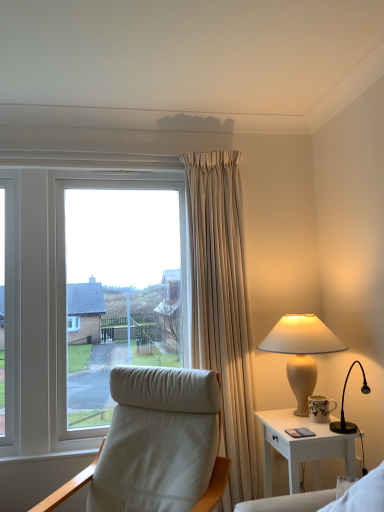
The width and height of the screenshot is (384, 512). Describe the element at coordinates (327, 498) in the screenshot. I see `white leather couch at lower right` at that location.

The height and width of the screenshot is (512, 384). Identify the location of white leather couch at lower right. (327, 498).

Where is `matte beige lamp at right`? Image resolution: width=384 pixels, height=512 pixels. matte beige lamp at right is located at coordinates (301, 351).

Is white glossy nightstand at right surrounding white leather chair at left?

No, white leather chair at left is located outside of white glossy nightstand at right.

From a real-world perspective, is white glossy nightstand at right positioned over white leather chair at left based on gravity?

No, from a real-world perspective, white glossy nightstand at right is not over white leather chair at left

Consider the image. Is white glossy nightstand at right next to white leather chair at left?

No, white glossy nightstand at right is not with white leather chair at left.

From the image's perspective, would you say white glossy nightstand at right is positioned over white leather chair at left?

No, from the image's perspective, white glossy nightstand at right is not above white leather chair at left.

Would you say white leather chair at left contains white glossy nightstand at right?

No, white glossy nightstand at right is not surrounded by white leather chair at left.

From a real-world perspective, is white leather chair at left under white glossy nightstand at right?

No, from a real-world perspective, white leather chair at left is not beneath white glossy nightstand at right.

From the image's perspective, which is above, white leather chair at left or white glossy nightstand at right?

white leather chair at left, from the image's perspective.

Is white leather chair at left positioned behind white glossy nightstand at right?

No, the depth of white leather chair at left is less than that of white glossy nightstand at right.

Is point (348, 503) closer or farther from the camera than point (289, 342)?

Clearly, point (348, 503) is closer to the camera than point (289, 342).

Is the position of white leather couch at lower right less distant than that of matte beige lamp at right?

Yes, white leather couch at lower right is in front of matte beige lamp at right.

From a real-world perspective, relative to matte beige lamp at right, is white leather couch at lower right vertically above or below?

white leather couch at lower right is situated lower than matte beige lamp at right in the real world.

Which is behind, point (43, 511) or point (373, 472)?

Point (43, 511)

Who is taller, white leather chair at left or white leather couch at lower right?

white leather chair at left.

What's the angular difference between white leather chair at left and white leather couch at lower right's facing directions?

white leather chair at left and white leather couch at lower right are facing 23.4 degrees away from each other.

Considering the positions of objects white leather chair at left and white leather couch at lower right in the image provided, who is behind, white leather chair at left or white leather couch at lower right?

white leather chair at left.

How much distance is there between matte beige lamp at right and white leather couch at lower right?

matte beige lamp at right and white leather couch at lower right are 30.22 inches apart from each other.

Is matte beige lamp at right oriented away from white leather couch at lower right?

No, matte beige lamp at right is not facing the opposite direction of white leather couch at lower right.

From the image's perspective, who appears lower, matte beige lamp at right or white leather couch at lower right?

white leather couch at lower right, from the image's perspective.

Which of these two, matte beige lamp at right or white leather couch at lower right, is smaller?

Smaller between the two is white leather couch at lower right.

Does matte beige lamp at right turn towards white glossy nightstand at right?

No, matte beige lamp at right is not facing towards white glossy nightstand at right.

Consider the image. Does matte beige lamp at right have a smaller size compared to white glossy nightstand at right?

Correct, matte beige lamp at right occupies less space than white glossy nightstand at right.

Is matte beige lamp at right shorter than white glossy nightstand at right?

In fact, matte beige lamp at right may be taller than white glossy nightstand at right.

From a real-world perspective, which is physically below, white glossy nightstand at right or matte beige lamp at right?

→ white glossy nightstand at right is physically lower.

In the image, there is a matte beige lamp at right. Where is `nightstand below it (from the image's perspective)`? The height and width of the screenshot is (512, 384). nightstand below it (from the image's perspective) is located at coordinates (302, 447).

What's the angular difference between white glossy nightstand at right and matte beige lamp at right's facing directions?

There is a 2.5-degree angle between the facing directions of white glossy nightstand at right and matte beige lamp at right.

From the image's perspective, between white glossy nightstand at right and matte beige lamp at right, which one is located above?

matte beige lamp at right.

You are a GUI agent. You are given a task and a screenshot of the screen. Output one action in this format:
    pyautogui.click(x=<x>, y=<y>)
    Task: Click on the chair to the left of white glossy nightstand at right
    
    Given the screenshot: What is the action you would take?
    pyautogui.click(x=68, y=487)

Identify the location of chair located above the white glossy nightstand at right (from the image's perspective). (68, 487).

Which object lies further to the anchor point white glossy nightstand at right, white leather couch at lower right or white leather chair at left?

white leather chair at left.

Which object lies further to the anchor point white leather chair at left, white glossy nightstand at right or matte beige lamp at right?

Based on the image, matte beige lamp at right appears to be further to white leather chair at left.

Looking at the image, which one is located further to white leather couch at lower right, white glossy nightstand at right or matte beige lamp at right?

Based on the image, matte beige lamp at right appears to be further to white leather couch at lower right.

Based on their spatial positions, is white glossy nightstand at right or white leather chair at left further from white leather couch at lower right?

white leather chair at left lies further to white leather couch at lower right than the other object.

Looking at the image, which one is located further to white glossy nightstand at right, white leather couch at lower right or matte beige lamp at right?

white leather couch at lower right.

When comparing their distances from white leather couch at lower right, does matte beige lamp at right or white glossy nightstand at right seem closer?

The object closer to white leather couch at lower right is white glossy nightstand at right.

Looking at the image, which one is located closer to matte beige lamp at right, white leather chair at left or white glossy nightstand at right?

The object closer to matte beige lamp at right is white glossy nightstand at right.

Looking at the image, which one is located further to white glossy nightstand at right, matte beige lamp at right or white leather couch at lower right?

white leather couch at lower right is further to white glossy nightstand at right.

Image resolution: width=384 pixels, height=512 pixels. I want to click on chair located between white leather couch at lower right and matte beige lamp at right in the depth direction, so click(68, 487).

You are a GUI agent. You are given a task and a screenshot of the screen. Output one action in this format:
    pyautogui.click(x=<x>, y=<y>)
    Task: Click on the nightstand located between white leather chair at left and matte beige lamp at right in the left-right direction
    
    Given the screenshot: What is the action you would take?
    pyautogui.click(x=302, y=447)

Locate an element on the screen. nightstand located between white leather couch at lower right and matte beige lamp at right in the depth direction is located at coordinates click(302, 447).

At what (x,y) coordinates should I click in order to perform the action: click on couch situated between white leather chair at left and white glossy nightstand at right from left to right. Please return your answer as a coordinate pair (x, y). Looking at the image, I should click on (327, 498).